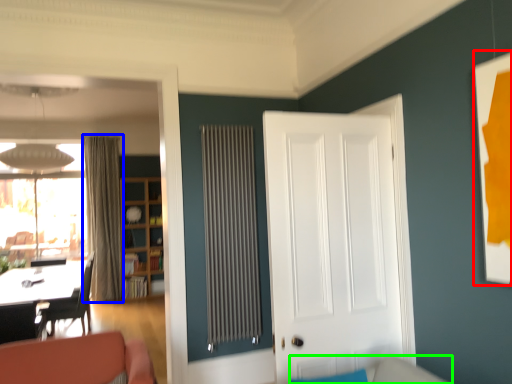
Question: Which object is the farthest from picture frame (highlighted by a red box)? Choose among these: curtain (highlighted by a blue box) or couch (highlighted by a green box).

Choices:
 (A) curtain
 (B) couch

Answer: (A)